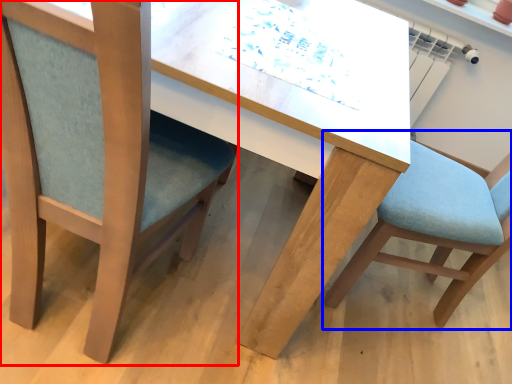
Question: Which of the following is the closest to the observer, chair (highlighted by a red box) or chair (highlighted by a blue box)?

Choices:
 (A) chair
 (B) chair

Answer: (A)